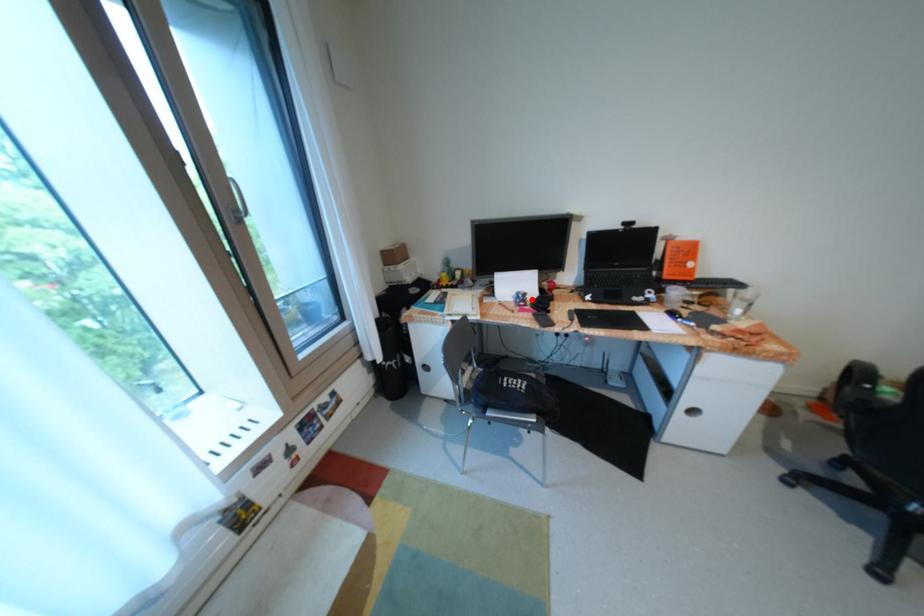
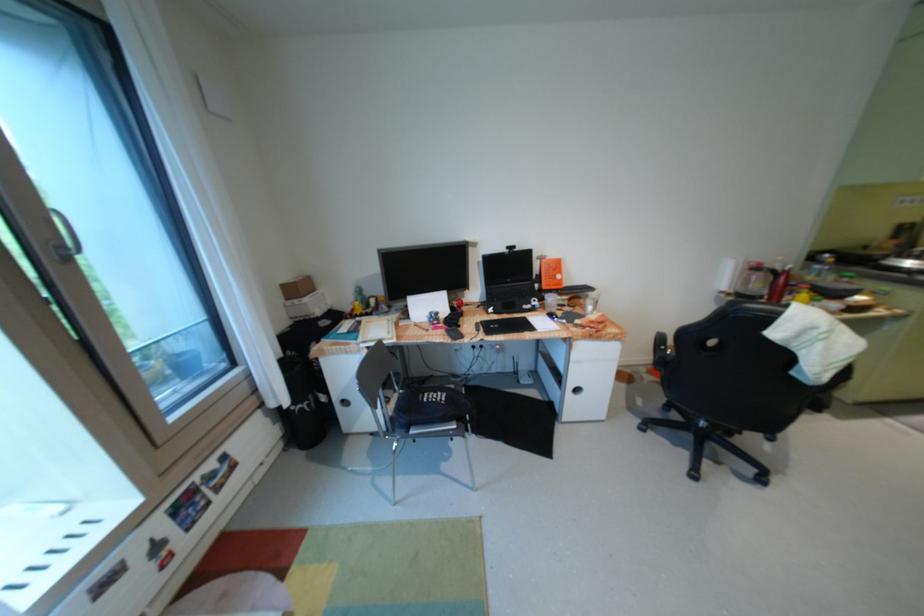
Question: I am providing you with two images of the same scene from different viewpoints. A red point is marked on the first image. Can you still see the location of the red point in image 2?

Choices:
 (A) Yes
 (B) No

Answer: (A)